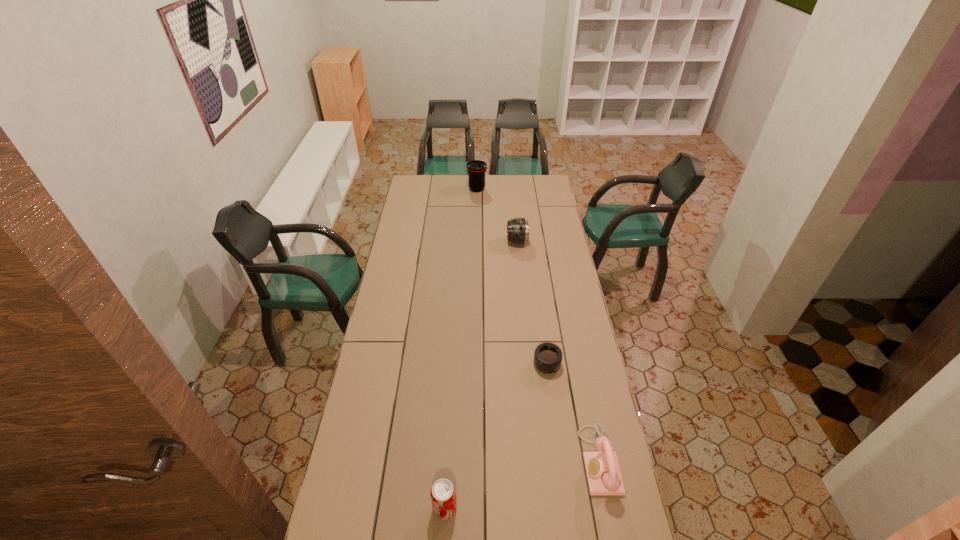
This screenshot has height=540, width=960. What are the coordinates of `free space at the far edge` in the screenshot? It's located at (502, 181).

In the image, there is a desktop. At what (x,y) coordinates should I click in order to perform the action: click on vacant space at the left edge. Please return your answer as a coordinate pair (x, y). The height and width of the screenshot is (540, 960). Looking at the image, I should click on (412, 260).

The image size is (960, 540). Find the location of `vacant space at the right edge of the desktop`. vacant space at the right edge of the desktop is located at coordinates point(542,205).

In the image, there is a desktop. Where is `blank space at the far right corner`? The image size is (960, 540). blank space at the far right corner is located at coordinates (528, 180).

You are a GUI agent. You are given a task and a screenshot of the screen. Output one action in this format:
    pyautogui.click(x=<x>, y=<y>)
    Task: Click on the vacant space that's between the rightmost object and the third farthest object
    The image size is (960, 540).
    Given the screenshot: What is the action you would take?
    pyautogui.click(x=573, y=413)

Where is `free spot between the farthest object and the second nearest telephoto lens`? free spot between the farthest object and the second nearest telephoto lens is located at coordinates (497, 215).

Image resolution: width=960 pixels, height=540 pixels. What are the coordinates of `vacant area that lies between the second farthest object and the soda can` in the screenshot? It's located at (481, 375).

Where is `vacant space that's between the soda can and the shortest telephoto lens`? vacant space that's between the soda can and the shortest telephoto lens is located at coordinates (496, 436).

This screenshot has height=540, width=960. I want to click on vacant space in between the leftmost telephoto lens and the fourth nearest object, so click(x=497, y=215).

Locate an element on the screen. The height and width of the screenshot is (540, 960). free space between the leftmost telephoto lens and the shortest object is located at coordinates (512, 277).